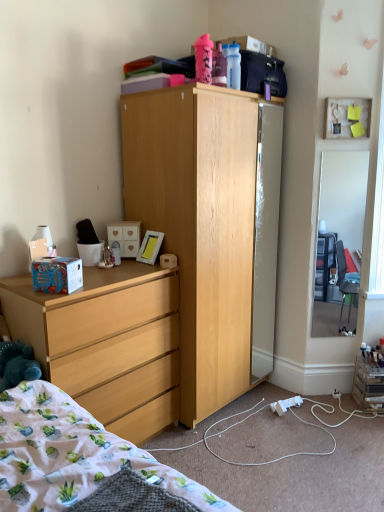
I want to click on vacant space to the right of light wood cabinet at center, so click(x=310, y=420).